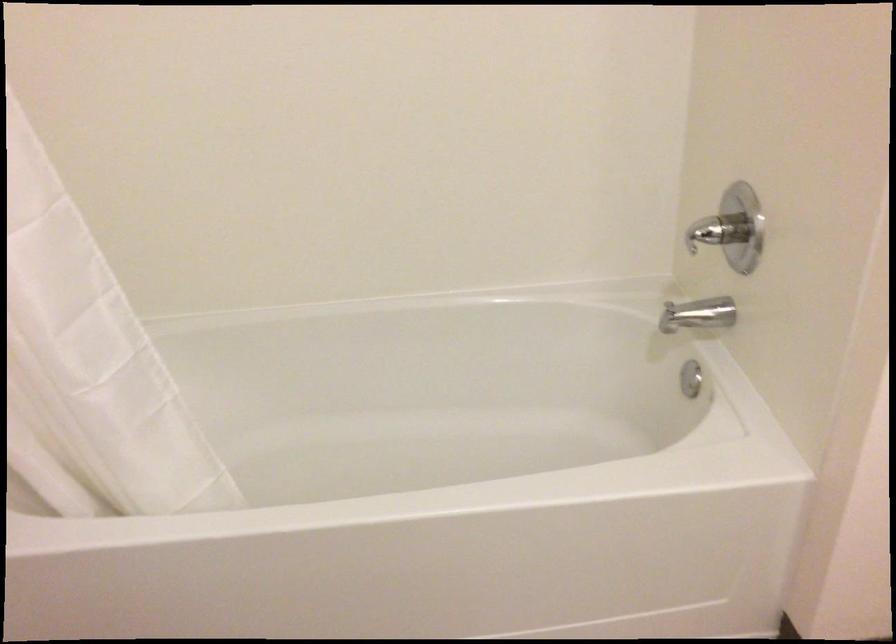
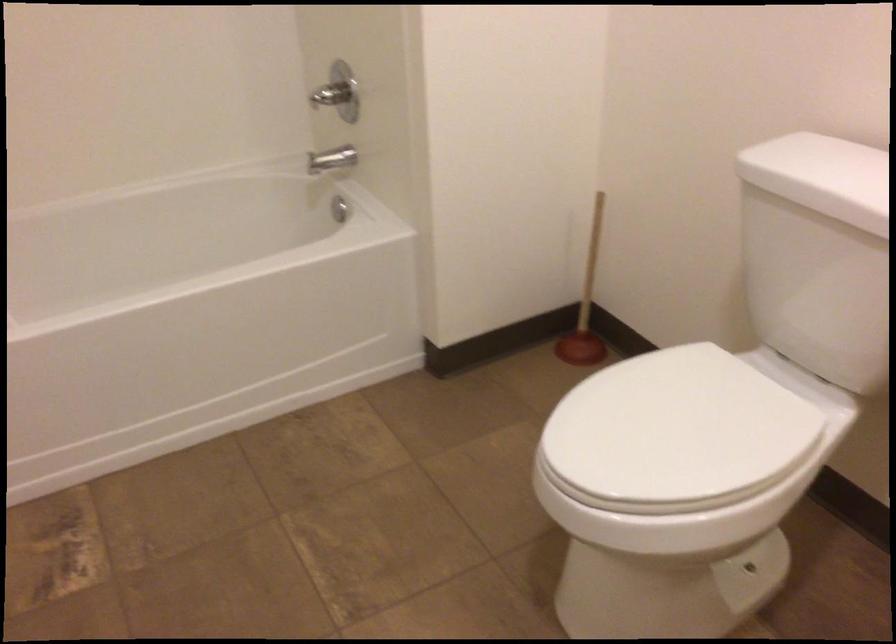
Question: The images are taken continuously from a first-person perspective. In which direction is your viewpoint rotating?

Choices:
 (A) Left
 (B) Right
 (C) Up
 (D) Down

Answer: (B)